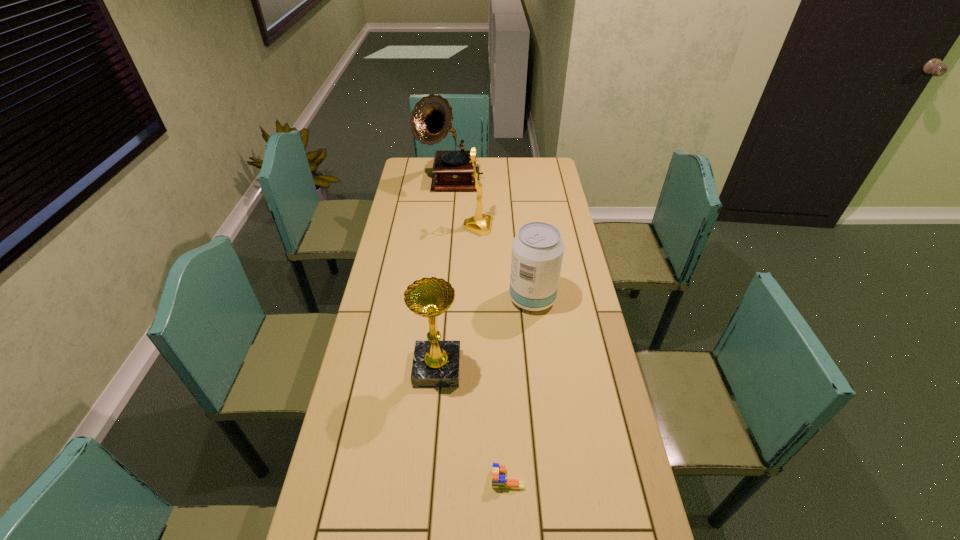
You are a GUI agent. You are given a task and a screenshot of the screen. Output one action in this format:
    pyautogui.click(x=<x>, y=<y>)
    Task: Click on the free space between the alcohol and the Lego
    
    Given the screenshot: What is the action you would take?
    pyautogui.click(x=520, y=389)

Locate an element on the screen. This screenshot has height=540, width=960. vacant point located between the fourth farthest object and the record player is located at coordinates (444, 275).

This screenshot has width=960, height=540. What are the coordinates of `vacant area that lies between the alcohol and the nearer award` in the screenshot? It's located at (485, 333).

Locate an element on the screen. This screenshot has width=960, height=540. empty space that is in between the fourth nearest object and the farthest object is located at coordinates (464, 205).

Where is `vacant area that lies between the alcohol and the nearest object`? This screenshot has width=960, height=540. vacant area that lies between the alcohol and the nearest object is located at coordinates (520, 389).

I want to click on vacant area that lies between the nearer award and the third farthest object, so click(x=485, y=333).

Where is `blank region between the second farthest object and the shortest object`? blank region between the second farthest object and the shortest object is located at coordinates (492, 353).

The width and height of the screenshot is (960, 540). I want to click on object identified as the third closest to the fourth nearest object, so click(x=436, y=363).

What are the coordinates of `object that is the fourth closest to the record player` in the screenshot? It's located at point(499,480).

Identify the location of vacant area that satisfies the following two spatial constraints: 1. on the back side of the Lego; 2. on the left side of the third farthest object. (500, 299).